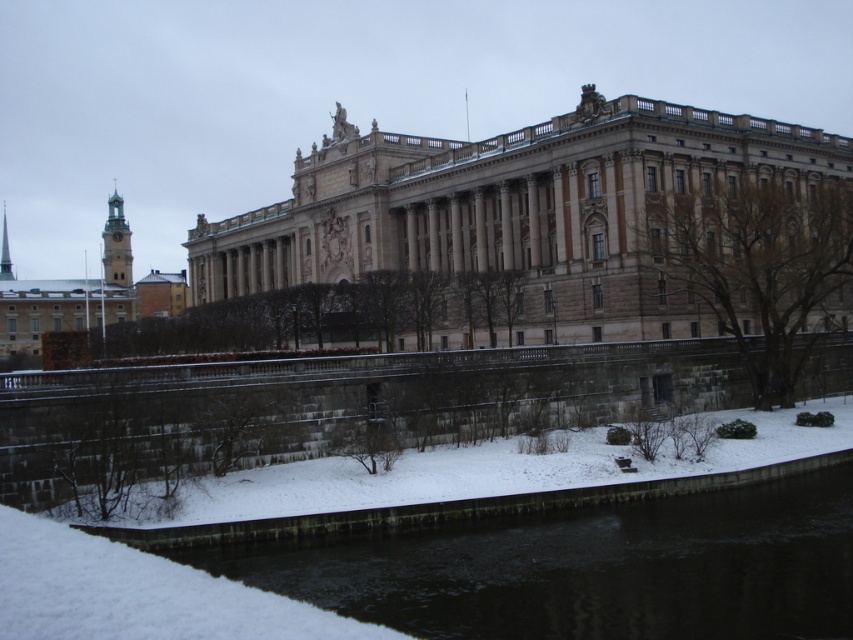
Question: Can you confirm if beige stone palace at center is wider than black ice at lower left?

Choices:
 (A) yes
 (B) no

Answer: (A)

Question: Which object appears closest to the camera in this image?

Choices:
 (A) beige stone palace at center
 (B) black ice at lower left

Answer: (B)

Question: Which point is farther from the camera taking this photo?

Choices:
 (A) (335, 544)
 (B) (381, 211)
 (C) (103, 326)

Answer: (B)

Question: Does beige stone palace at center appear on the left side of golden stone tower at left?

Choices:
 (A) yes
 (B) no

Answer: (B)

Question: Is beige stone palace at center above black ice at lower left?

Choices:
 (A) no
 (B) yes

Answer: (B)

Question: Which of the following is the closest to the observer?

Choices:
 (A) (21, 301)
 (B) (833, 634)

Answer: (B)